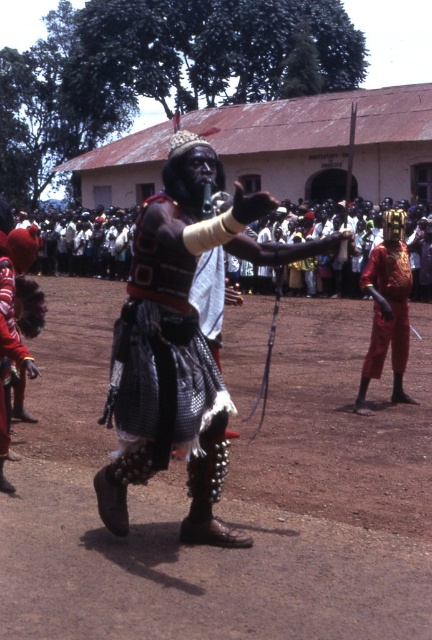
From the picture: Based on the scene description, where is the brown dirt field at center located in terms of coordinates?

The brown dirt field at center is located at point coordinates of (x=224, y=499).

You are a dancer in the performance and need to move from your current position near the textured fabric skirt at center to retrieve the shiny gold armor at right. Considering the space between them, can you move directly to the armor without any obstruction?

The distance between the textured fabric skirt at center and the shiny gold armor at right is 12.58 feet, so yes, you can move directly to the armor without any obstruction as there is sufficient space.

You are a photographer trying to capture the entire scene of the cultural performance. You notice the brown dirt field at center and the red fabric skirt at lower left. Which object would require you to zoom out more to include in your frame?

The brown dirt field at center is bigger than the red fabric skirt at lower left, so you would need to zoom out more to include the brown dirt field at center in your frame.